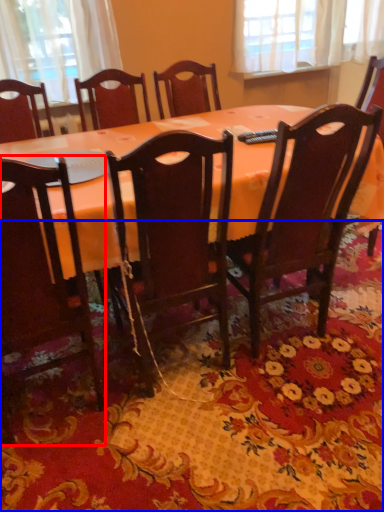
Question: Which of the following is the closest to the observer, chair (highlighted by a red box) or mat (highlighted by a blue box)?

Choices:
 (A) chair
 (B) mat

Answer: (A)